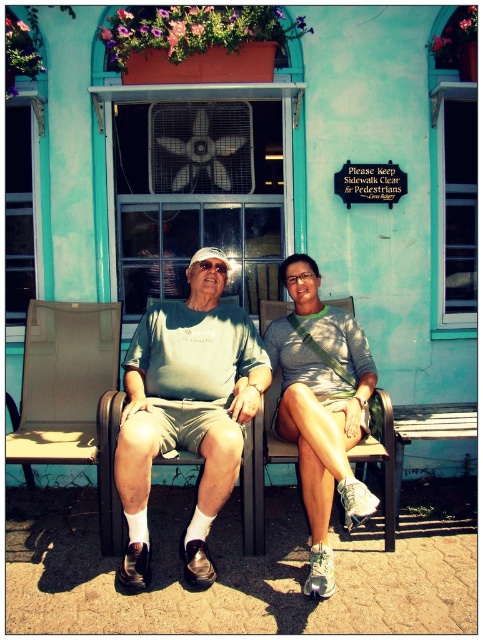
Question: Does matte green shirt at center appear on the right side of matte gray tank top at center?

Choices:
 (A) no
 (B) yes

Answer: (A)

Question: Can you confirm if matte green shirt at center is positioned below matte gray tank top at center?

Choices:
 (A) yes
 (B) no

Answer: (B)

Question: Among these objects, which one is nearest to the camera?

Choices:
 (A) matte green shirt at center
 (B) matte gray tank top at center

Answer: (B)

Question: Which object appears closest to the camera in this image?

Choices:
 (A) matte green shirt at center
 (B) matte gray tank top at center

Answer: (B)

Question: Is matte green shirt at center bigger than matte gray tank top at center?

Choices:
 (A) yes
 (B) no

Answer: (A)